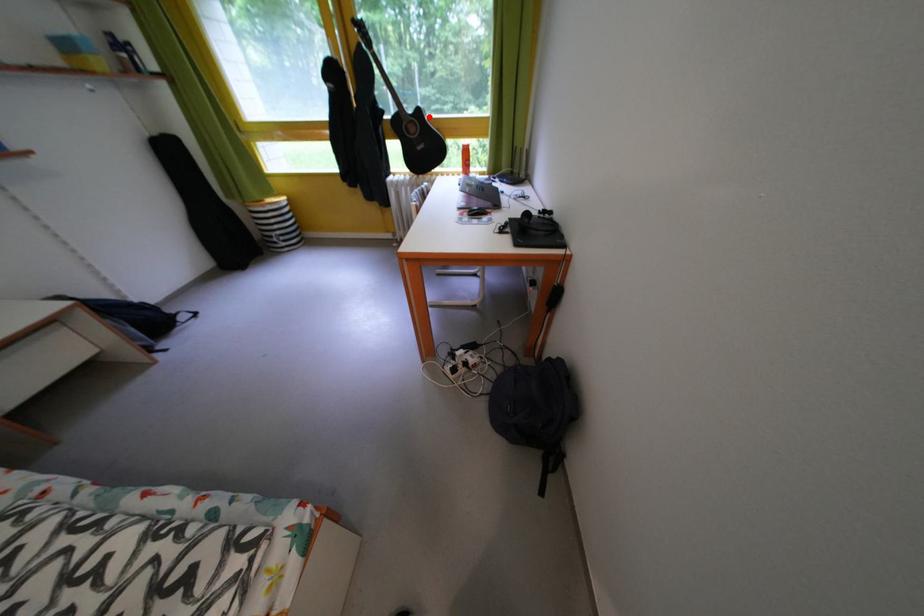
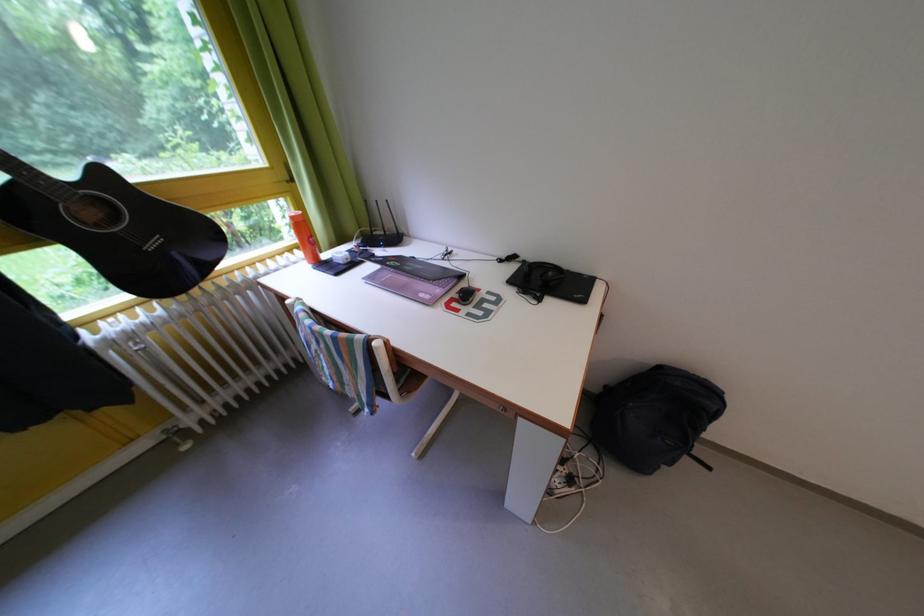
Locate, in the second image, the point that corresponds to the highlighted location in the first image.

(112, 179)